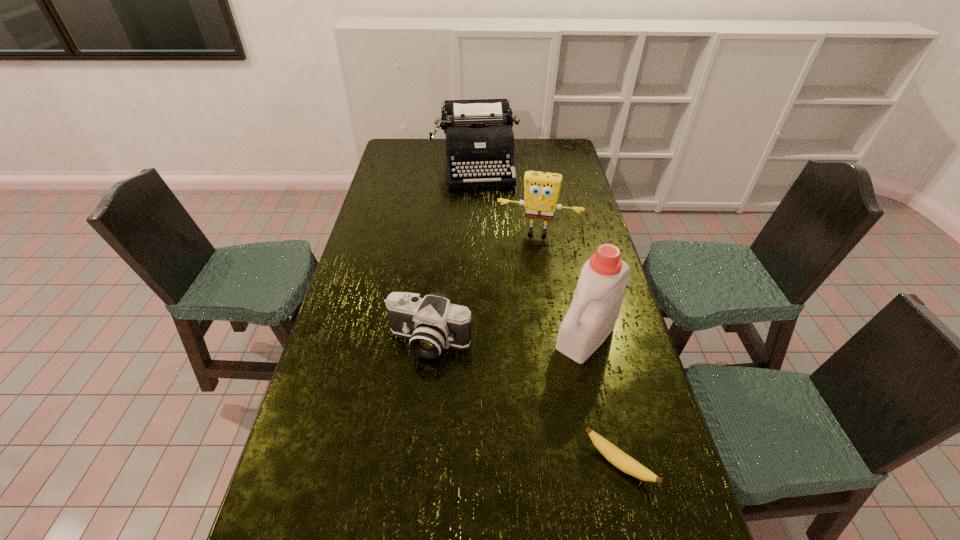
The width and height of the screenshot is (960, 540). I want to click on vacant space on the desktop that is between the camera and the nearest object and is positioned on the face of the fourth nearest object, so click(511, 394).

The width and height of the screenshot is (960, 540). What are the coordinates of `free space on the desktop that is between the camera and the banana and is positioned on the typing side of the farthest object` in the screenshot? It's located at (505, 390).

At what (x,y) coordinates should I click in order to perform the action: click on vacant space on the desktop that is between the camera and the shortest object and is positioned on the handle side of the tallest object. Please return your answer as a coordinate pair (x, y). Looking at the image, I should click on (526, 404).